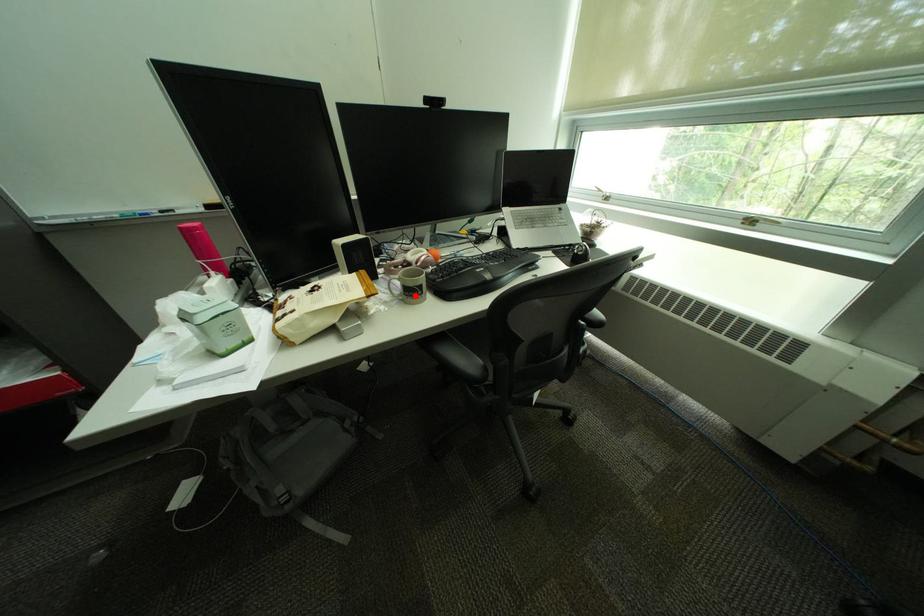
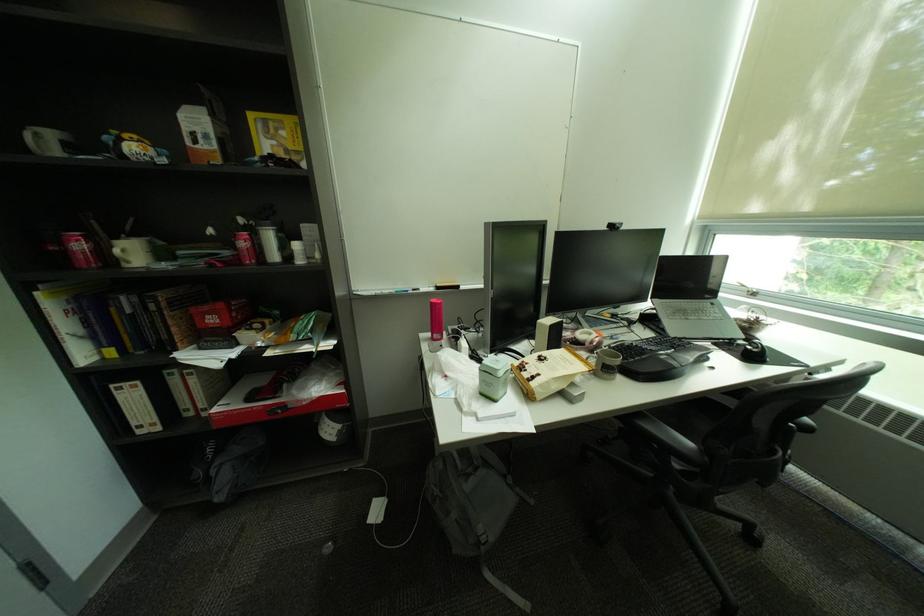
Where in the second image is the point corresponding to the highlighted location from the first image?

(613, 371)